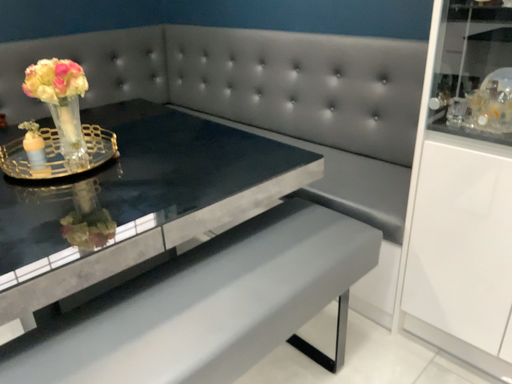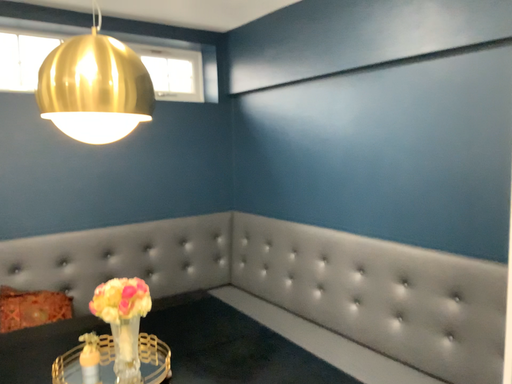
Question: Which way did the camera rotate in the video?

Choices:
 (A) rotated left
 (B) rotated right

Answer: (A)